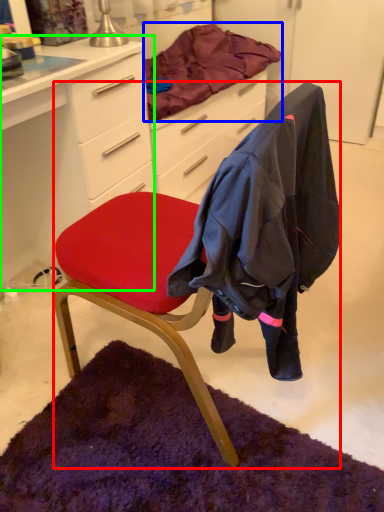
Question: Which is farther away from chair (highlighted by a red box)? blanket (highlighted by a blue box) or desk (highlighted by a green box)?

Choices:
 (A) blanket
 (B) desk

Answer: (A)